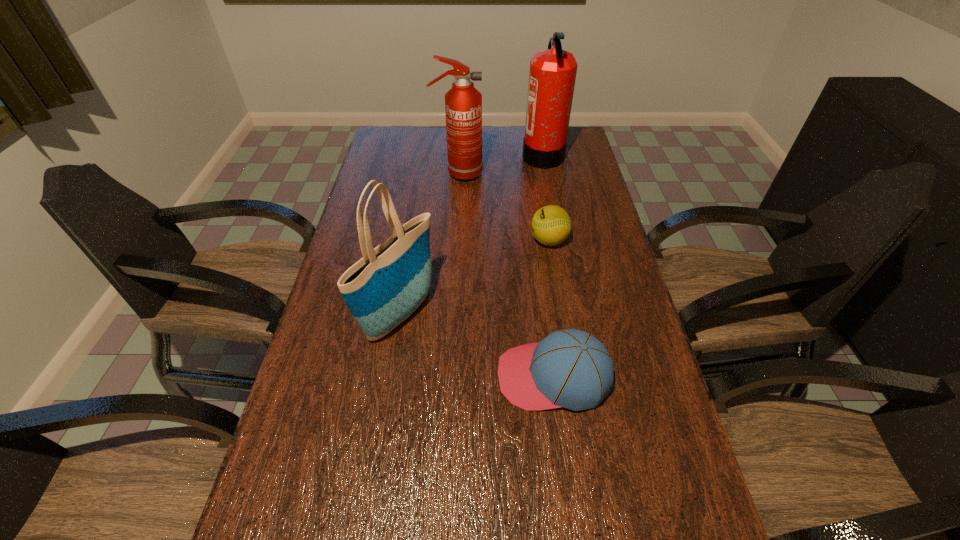
The image size is (960, 540). Identify the location of the right fire extinguisher. (552, 75).

This screenshot has width=960, height=540. I want to click on the left fire extinguisher, so click(463, 102).

You are a GUI agent. You are given a task and a screenshot of the screen. Output one action in this format:
    pyautogui.click(x=<x>, y=<y>)
    Task: Click on the tote bag
    This screenshot has height=540, width=960.
    Given the screenshot: What is the action you would take?
    pyautogui.click(x=381, y=290)

What are the coordinates of `baseball cap` in the screenshot? It's located at (569, 368).

Image resolution: width=960 pixels, height=540 pixels. Identify the location of the third farthest object. (551, 225).

Locate an element on the screen. vacant space located on the front side of the right fire extinguisher is located at coordinates (419, 155).

Locate an element on the screen. This screenshot has width=960, height=540. vacant space located 0.350m on the front side of the right fire extinguisher is located at coordinates (432, 155).

Where is `vacant space located on the front side of the right fire extinguisher`? vacant space located on the front side of the right fire extinguisher is located at coordinates (429, 155).

The image size is (960, 540). Find the location of `blank space located 0.260m at the nozzle of the left fire extinguisher`. blank space located 0.260m at the nozzle of the left fire extinguisher is located at coordinates (554, 174).

This screenshot has height=540, width=960. I want to click on vacant space located 0.260m on the front of the tote bag, so click(377, 461).